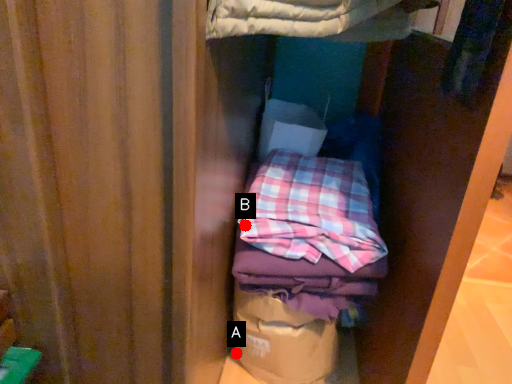
Question: Two points are circled on the image, labeled by A and B beside each circle. Among these points, which one is nearest to the camera?

Choices:
 (A) A is closer
 (B) B is closer

Answer: (B)